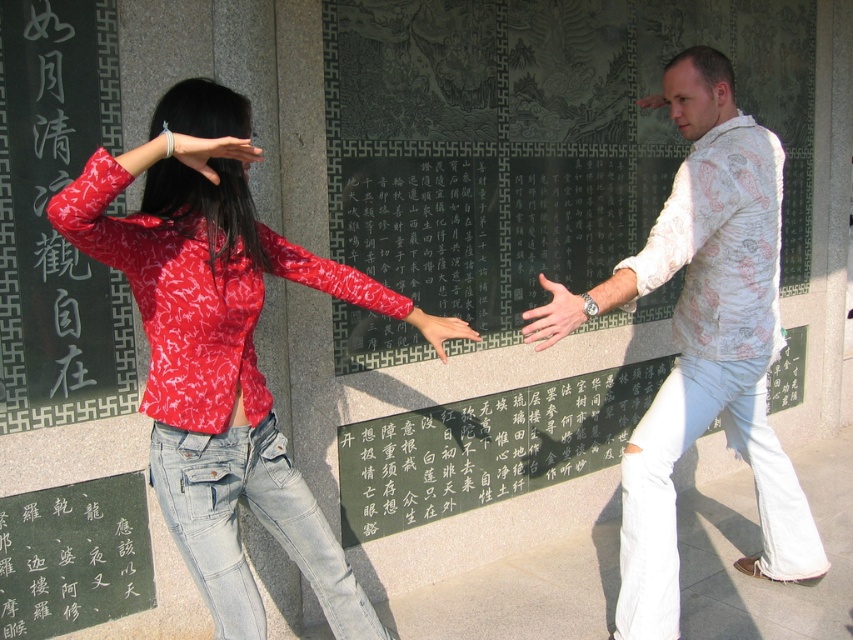
You are a photographer standing in front of the two people in the image. You want to take a photo of the denim at right and the white printed shirt at right. Can you fit both subjects into your camera frame if your camera has a minimum required distance of 40 centimeters between subjects to capture them clearly?

The denim at right and white printed shirt at right are 41.82 centimeters apart, which is greater than the camera frame requirement of 40 centimeters. Therefore, both subjects can be captured clearly in the photo.

Looking at this image, you are a photographer taking a picture of the matte red blouse at center and the matte black hand at center. Which object will appear bigger in the photo?

The matte red blouse at center will appear bigger in the photo because it is larger in size than the matte black hand at center.

You are an art student analyzing the composition of the image. The scene has a matte red blouse at center. According to the rule of thirds grid, is the blouse positioned along any of the grid lines or intersections?

The matte red blouse at center is located at point coordinates that align with the rule of thirds grid intersections, suggesting intentional placement for visual balance.